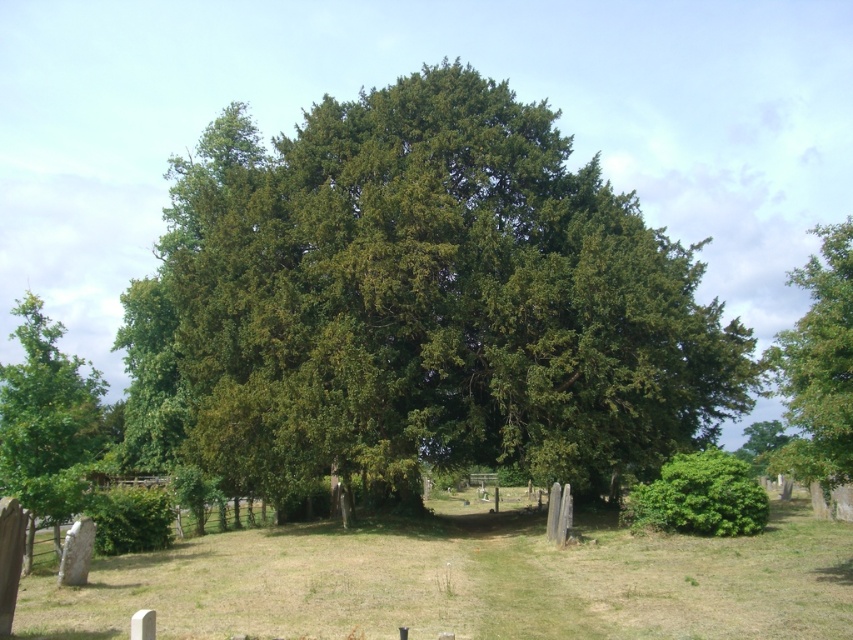
Does green grassy field at center appear under green leafy tree at right?

Correct, green grassy field at center is located below green leafy tree at right.

Is point (421, 540) behind point (805, 474)?

Yes, it is.

Is point (250, 624) positioned before point (827, 401)?

Yes, it is.

Find the location of a particular element. The height and width of the screenshot is (640, 853). green grassy field at center is located at coordinates (466, 582).

Who is positioned more to the left, green leafy tree at center or green leafy tree at left?

green leafy tree at left is more to the left.

In order to click on green leafy tree at center in this screenshot , I will do `click(419, 305)`.

Who is more forward, (613, 477) or (53, 529)?

Point (53, 529)

The image size is (853, 640). I want to click on green leafy tree at center, so click(419, 305).

Which of these two, green leafy tree at center or green grassy field at center, stands taller?

Standing taller between the two is green leafy tree at center.

Locate an element on the screen. The image size is (853, 640). green leafy tree at center is located at coordinates (419, 305).

Locate an element on the screen. This screenshot has width=853, height=640. green leafy tree at center is located at coordinates (419, 305).